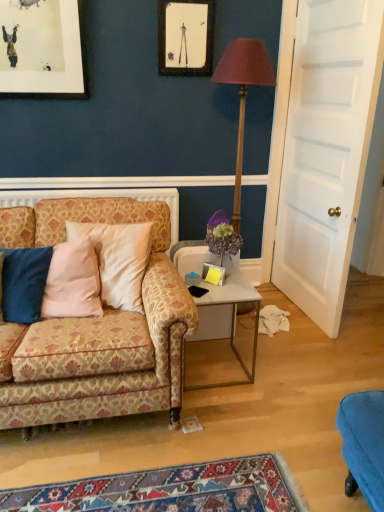
Measure the distance between point (x=225, y=238) and camera.

Point (x=225, y=238) and camera are 7.33 feet apart.

In order to face white glossy side table at center, should I rotate leftwards or rightwards?

Rotate your view right by about 2.729°.

At what (x,y) coordinates should I click in order to perform the action: click on patterned fabric couch at left. Please return your answer as a coordinate pair (x, y). The image size is (384, 512). Looking at the image, I should click on (96, 330).

Measure the distance between point (320, 150) and camera.

The depth of point (320, 150) is 8.90 feet.

Where is `matte purple vase at center`? The width and height of the screenshot is (384, 512). matte purple vase at center is located at coordinates (223, 239).

Find the location of `lamp that is above the patterned fabric couch at left (from the image's perspective)`. lamp that is above the patterned fabric couch at left (from the image's perspective) is located at coordinates (243, 93).

In terms of height, does wooden floor lamp at center look taller or shorter compared to patterned fabric couch at left?

Clearly, wooden floor lamp at center is taller compared to patterned fabric couch at left.

Is wooden floor lamp at center positioned with its back to patterned fabric couch at left?

No, wooden floor lamp at center's orientation is not away from patterned fabric couch at left.

In the scene shown: From the image's perspective, between wooden floor lamp at center and patterned fabric couch at left, who is located below?

patterned fabric couch at left appears lower in the image.

How many degrees apart are the facing directions of wooden floor lamp at center and matte black picture frame at upper center?

They differ by 1.09 degrees in their facing directions.

Is wooden floor lamp at center oriented towards matte black picture frame at upper center?

No, wooden floor lamp at center is not oriented towards matte black picture frame at upper center.

You are a GUI agent. You are given a task and a screenshot of the screen. Output one action in this format:
    pyautogui.click(x=<x>, y=<y>)
    Task: Click on the picture frame that appears on the left of wooden floor lamp at center
    This screenshot has width=384, height=512.
    Given the screenshot: What is the action you would take?
    pyautogui.click(x=185, y=37)

Does wooden floor lamp at center appear on the left side of matte black picture frame at upper center?

No.

Would you say white wooden door at right is part of wooden floor lamp at center's contents?

No, wooden floor lamp at center does not contain white wooden door at right.

Where is `door above the wooden floor lamp at center (from a real-world perspective)`? Image resolution: width=384 pixels, height=512 pixels. door above the wooden floor lamp at center (from a real-world perspective) is located at coordinates click(326, 151).

Between wooden floor lamp at center and white wooden door at right, which one appears on the left side from the viewer's perspective?

Positioned to the left is wooden floor lamp at center.

Considering the sizes of objects wooden floor lamp at center and white wooden door at right in the image provided, who is bigger, wooden floor lamp at center or white wooden door at right?

With larger size is white wooden door at right.

Is matte purple vase at center oriented away from matte black picture frame at upper center?

matte purple vase at center does not have its back to matte black picture frame at upper center.

From the image's perspective, is matte purple vase at center below matte black picture frame at upper center?

Yes, from the image's perspective, matte purple vase at center is beneath matte black picture frame at upper center.

Is matte purple vase at center beside matte black picture frame at upper center?

There is a gap between matte purple vase at center and matte black picture frame at upper center.

Looking at this image, from a real-world perspective, is matte black picture frame at upper center above or below wooden floor lamp at center?

matte black picture frame at upper center is situated higher than wooden floor lamp at center in the real world.

Is matte black picture frame at upper center inside or outside of wooden floor lamp at center?

The correct answer is: outside.

From the image's perspective, is matte black picture frame at upper center beneath wooden floor lamp at center?

Incorrect, from the image's perspective, matte black picture frame at upper center is higher than wooden floor lamp at center.

Does patterned fabric couch at left appear on the left side of white glossy side table at center?

Yes, patterned fabric couch at left is to the left of white glossy side table at center.

From the image's perspective, is patterned fabric couch at left positioned above or below white glossy side table at center?

Based on their image positions, patterned fabric couch at left is located above white glossy side table at center.

From a real-world perspective, is patterned fabric couch at left physically below white glossy side table at center?

Actually, patterned fabric couch at left is physically above white glossy side table at center in the real world.

Is patterned fabric couch at left completely or partially outside of white glossy side table at center?

Yes, patterned fabric couch at left is outside of white glossy side table at center.

Is the depth of matte purple vase at center greater than that of white glossy side table at center?

That is True.

From the image's perspective, is matte purple vase at center beneath white glossy side table at center?

Incorrect, from the image's perspective, matte purple vase at center is higher than white glossy side table at center.

Image resolution: width=384 pixels, height=512 pixels. What are the coordinates of `table below the matte purple vase at center (from the image's perspective)` in the screenshot? It's located at 227,318.

This screenshot has width=384, height=512. In order to click on studio couch lying below the wooden floor lamp at center (from the image's perspective) in this screenshot , I will do `click(96, 330)`.

Where is `picture frame behind the wooden floor lamp at center`? This screenshot has width=384, height=512. picture frame behind the wooden floor lamp at center is located at coordinates (185, 37).

Considering their positions, is patterned fabric couch at left positioned further to white wooden door at right than matte black picture frame at upper center?

Based on the image, patterned fabric couch at left appears to be further to white wooden door at right.

Estimate the real-world distances between objects in this image. Which object is further from patterned fabric couch at left, matte black picture frame at upper center or white glossy side table at center?

Among the two, matte black picture frame at upper center is located further to patterned fabric couch at left.

Considering their positions, is white glossy side table at center positioned closer to wooden floor lamp at center than matte black picture frame at upper center?

matte black picture frame at upper center is closer to wooden floor lamp at center.

From the image, which object appears to be farther from white glossy side table at center, matte purple vase at center or white wooden door at right?

white wooden door at right is further to white glossy side table at center.

Estimate the real-world distances between objects in this image. Which object is further from matte black picture frame at upper center, patterned fabric couch at left or white glossy side table at center?

patterned fabric couch at left lies further to matte black picture frame at upper center than the other object.

Looking at the image, which one is located further to matte black picture frame at upper center, matte purple vase at center or white wooden door at right?

matte purple vase at center.

Based on their spatial positions, is matte black picture frame at upper center or matte purple vase at center further from white wooden door at right?

matte black picture frame at upper center lies further to white wooden door at right than the other object.

When comparing their distances from white wooden door at right, does matte black picture frame at upper center or patterned fabric couch at left seem further?

Among the two, patterned fabric couch at left is located further to white wooden door at right.

Find the location of a particular element. This screenshot has width=384, height=512. studio couch between wooden floor lamp at center and white glossy side table at center vertically is located at coordinates (96, 330).

Find the location of a particular element. The image size is (384, 512). lamp between white wooden door at right and white glossy side table at center in the up-down direction is located at coordinates (243, 93).

In order to click on flower between patterned fabric couch at left and wooden floor lamp at center from left to right in this screenshot , I will do `click(223, 239)`.

In order to click on studio couch between matte black picture frame at upper center and white glossy side table at center in the up-down direction in this screenshot , I will do `click(96, 330)`.